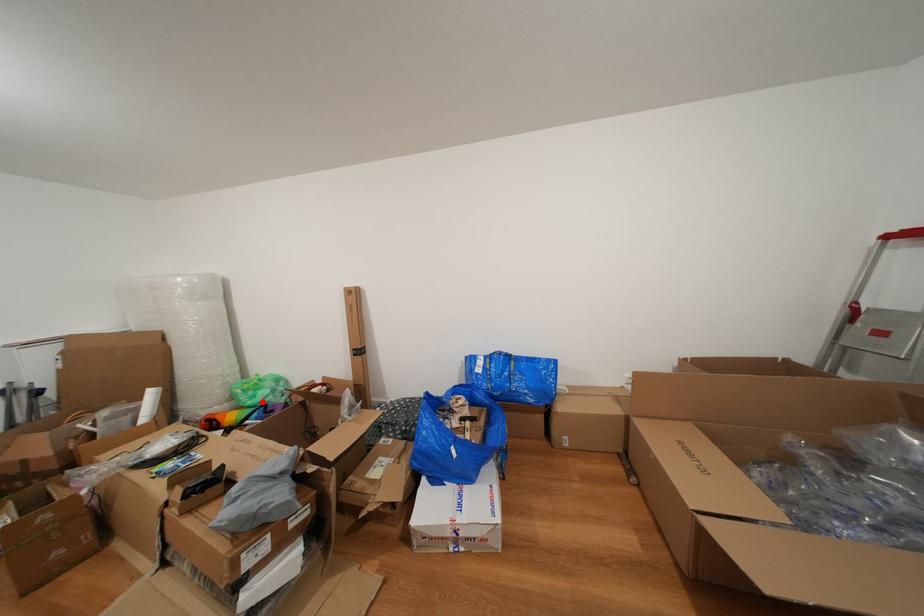
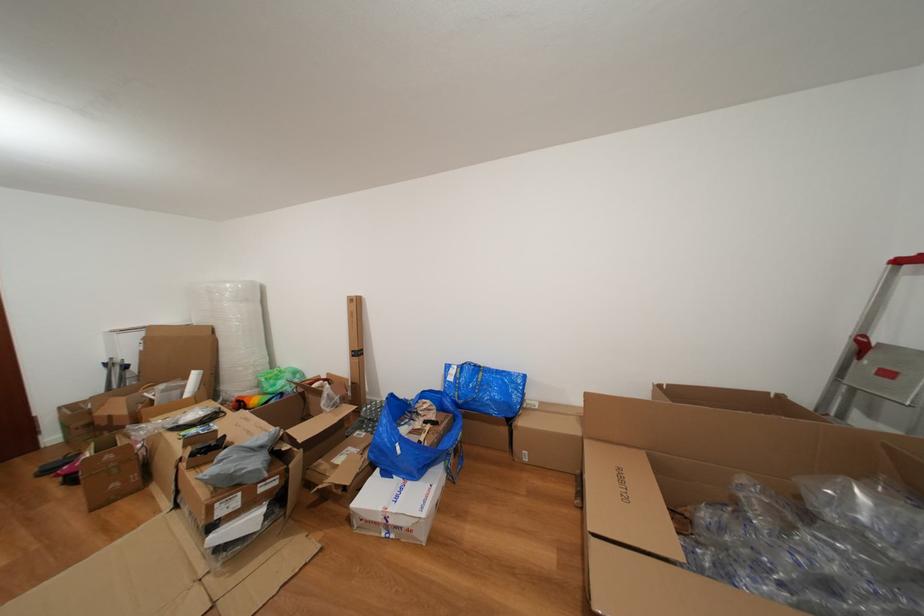
Locate, in the second image, the point that corresponds to the highlighted location in the first image.

(283, 390)